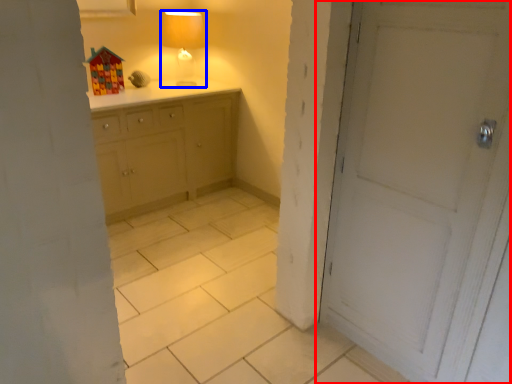
Question: Among these objects, which one is farthest to the camera, door (highlighted by a red box) or table lamp (highlighted by a blue box)?

Choices:
 (A) door
 (B) table lamp

Answer: (B)